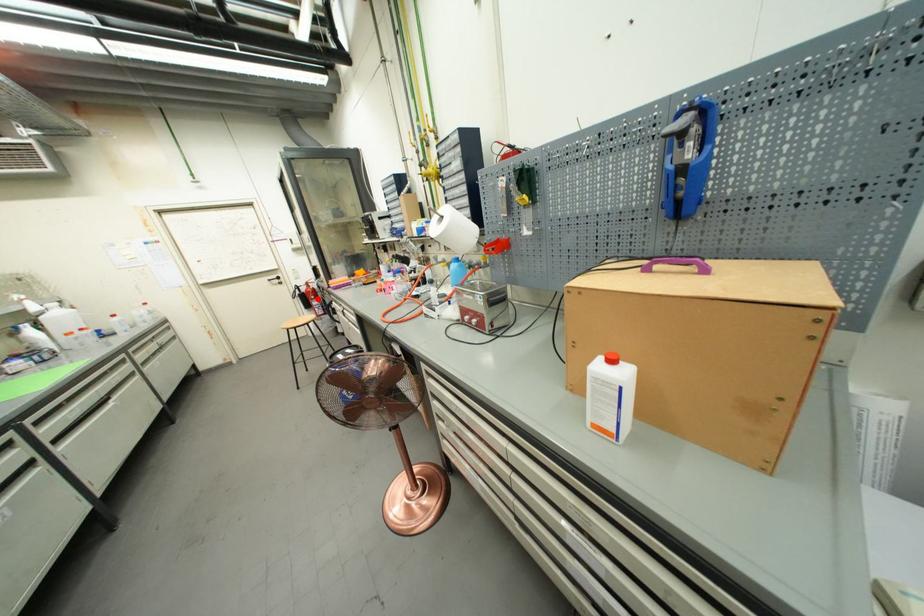
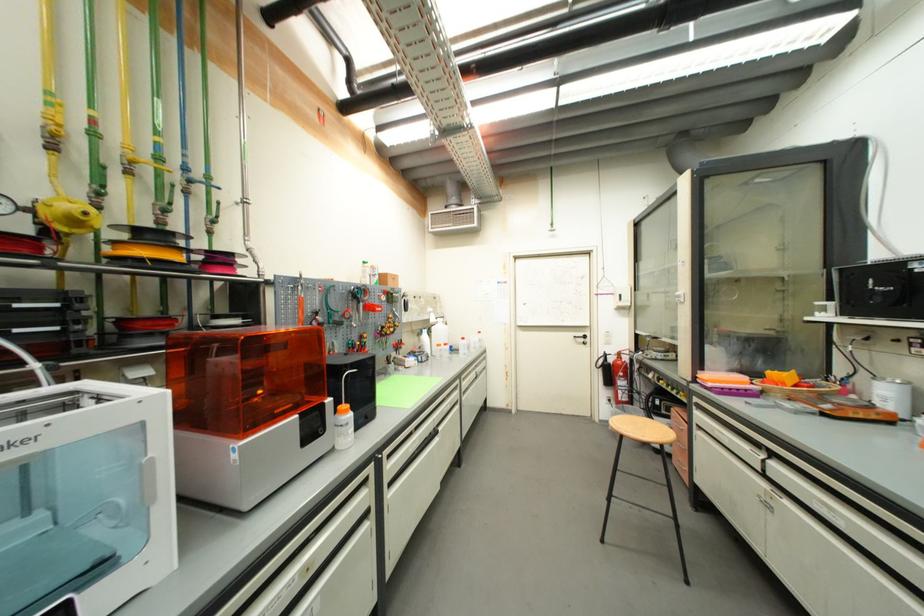
Where in the second image is the point corresponding to the highlighted location from the first image?

(626, 376)